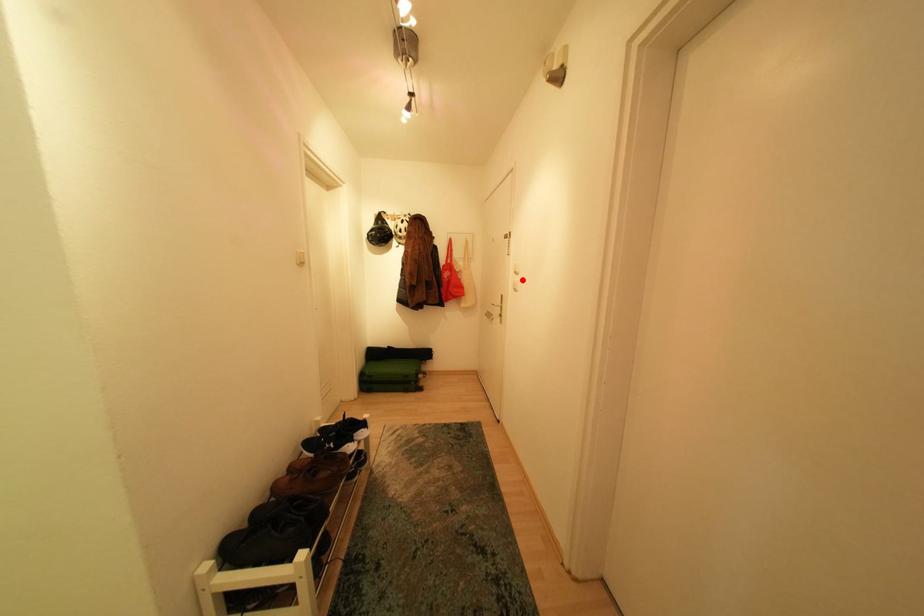
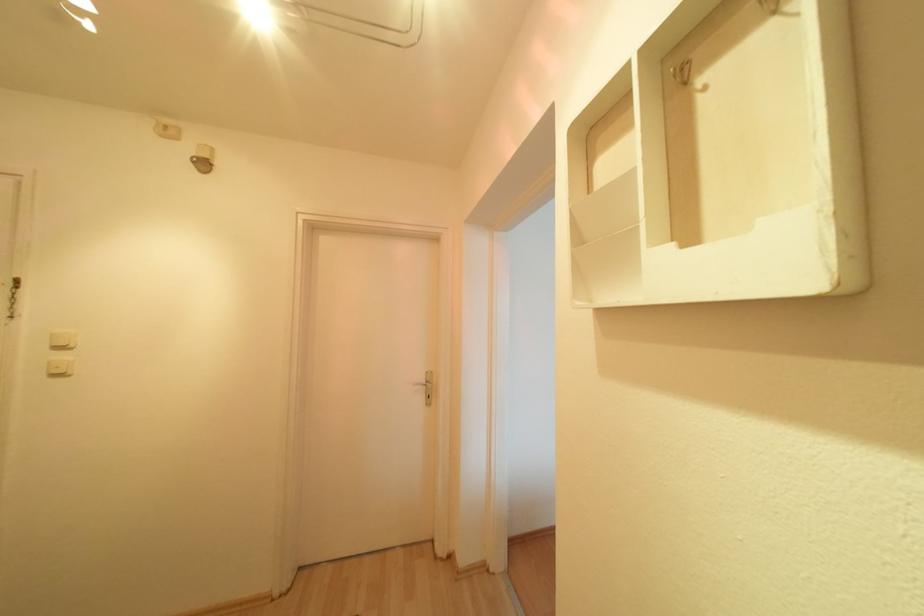
Find the pixel in the second image that matches the highlighted location in the first image.

(67, 358)